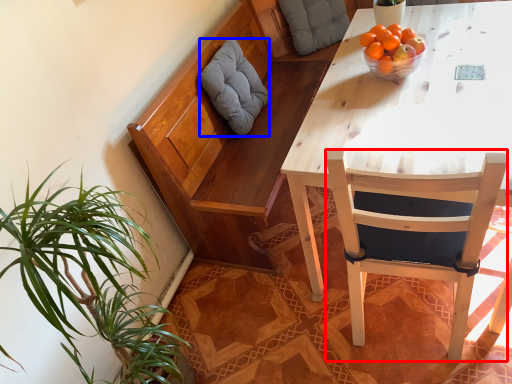
Question: Among these objects, which one is farthest to the camera, chair (highlighted by a red box) or pillow (highlighted by a blue box)?

Choices:
 (A) chair
 (B) pillow

Answer: (B)